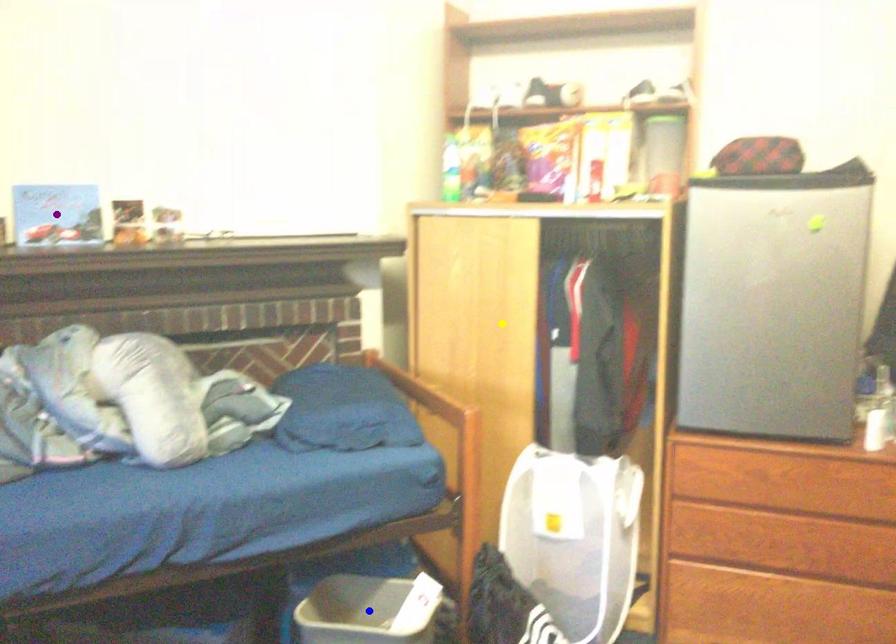
Order these from nearest to farthest:
A) yellow point
B) blue point
C) purple point

yellow point
purple point
blue point